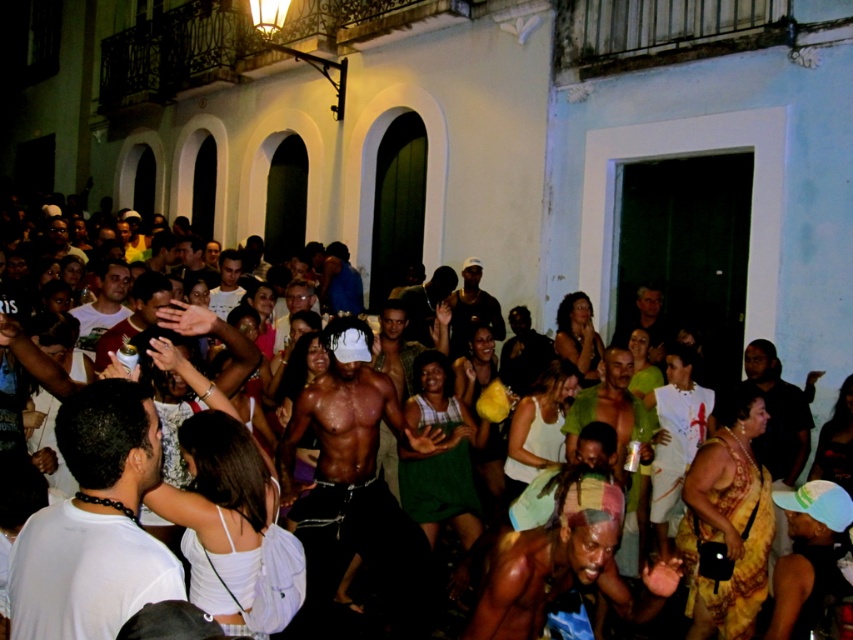
Consider the image. You are a photographer standing in the crowd at the event. You see both the shiny black skin at center and the shiny black shirt at center. Which object is closer to you?

The shiny black skin at center is closer to you because it is further to the viewer than the shiny black shirt at center.

You are a photographer trying to capture a closeup of the shiny black skin at center and the shiny black shirt at center. Since you want to focus on the details of the skin, which object should you zoom in on first to ensure it takes up more of the frame?

The shiny black skin at center has a lesser width compared to the shiny black shirt at center, so to focus on the details of the skin, you should zoom in on the shiny black skin at center first to make it larger in the frame.